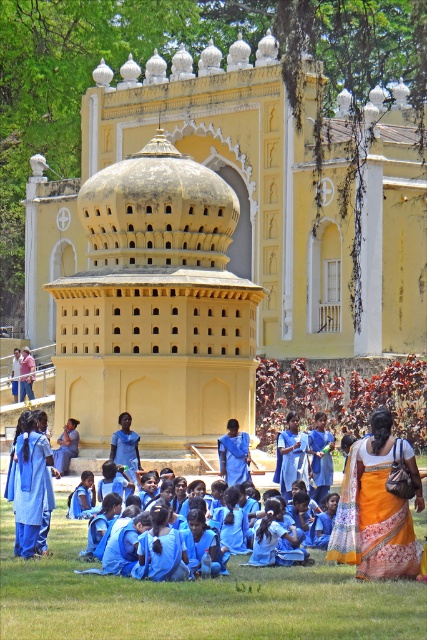
Looking at this image, you are a photographer planning to take a group photo of the yellow matte palace at center and the orange printed sari at lower right. Which object should be placed closer to the camera to ensure both fit in the frame?

The yellow matte palace at center might be wider than orange printed sari at lower right, so to ensure both fit in the frame, the wider yellow matte palace at center should be placed closer to the camera.

Based on the photo, you are a photographer standing in front of the yellow matte palace at center and the green grass at lower center. You want to take a photo that includes both objects. Which object should you position to the left side of your frame to ensure both are visible?

To include both the yellow matte palace at center and the green grass at lower center in your photo, position the green grass at lower center on the left side of your frame. Since the yellow matte palace at center is already on the right side of the green grass at lower center, placing the grass on the left will align them correctly.

From the picture: You are a photographer planning to capture a group photo of the orange printed sari at lower right and the matte blue dress at center. Which of the two clothing items should you focus on to ensure they are both clearly visible in the photo?

The orange printed sari at lower right is bigger than the matte blue dress at center, so focusing on the orange printed sari at lower right would ensure both are clearly visible as it occupies more space in the frame.